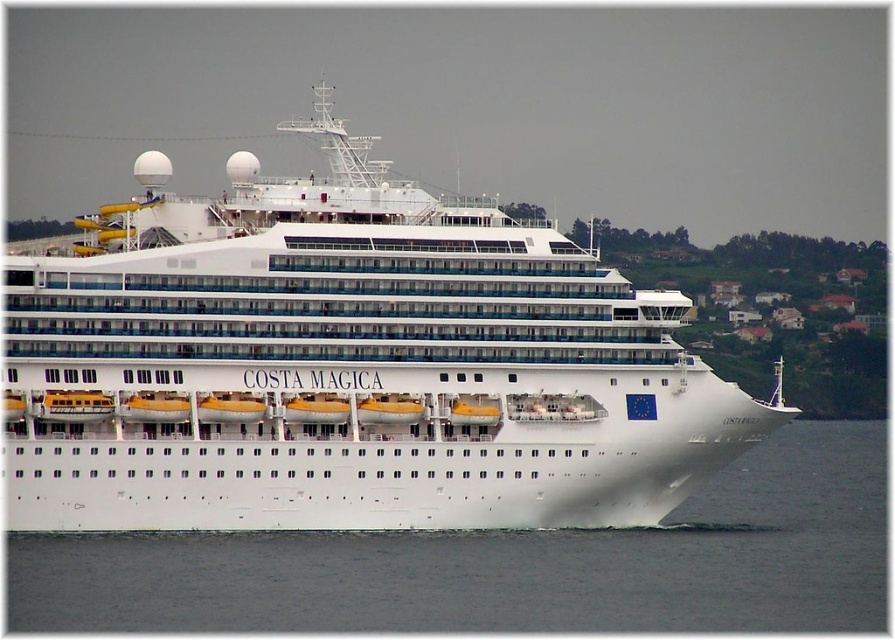
You are standing on the deck of the cruise ship and looking down. Which object is closer to you between the white glossy cruise ship at center and the white water at lower center?

The white glossy cruise ship at center is located above the white water at lower center, so the white glossy cruise ship at center is closer to you.